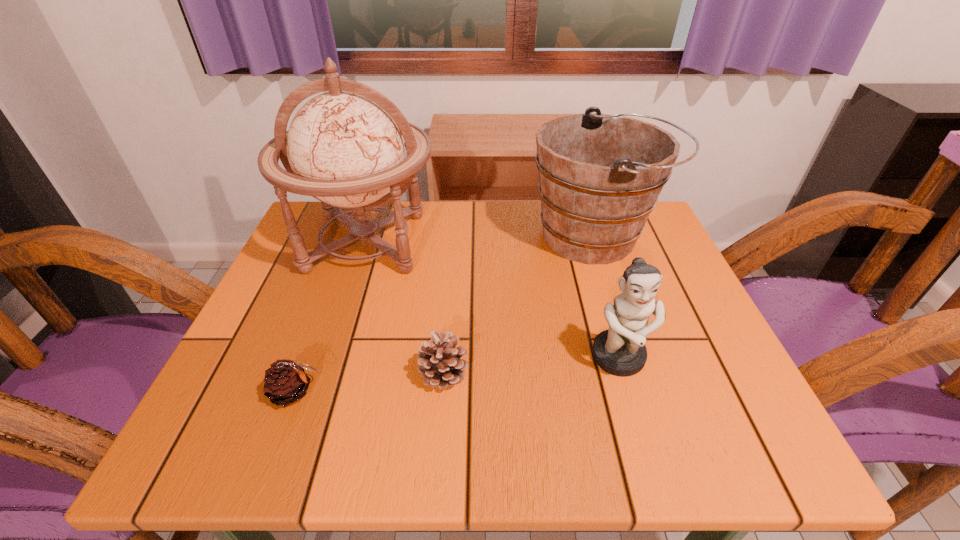
You are a GUI agent. You are given a task and a screenshot of the screen. Output one action in this format:
    pyautogui.click(x=<x>, y=<y>)
    Task: Click on the vacant area that satisfies the following two spatial constraints: 1. on the front side of the right pinecone; 2. with a leaf charm attached to the shorter pinecone
    
    Given the screenshot: What is the action you would take?
    pyautogui.click(x=443, y=392)

In order to click on vacant area in the image that satisfies the following two spatial constraints: 1. on the handle side of the bucket; 2. on the front-facing side of the third tallest object in this screenshot , I will do `click(636, 359)`.

Locate an element on the screen. free spot that satisfies the following two spatial constraints: 1. on the front-facing side of the tallest object; 2. with a leaf charm attached to the shorter pinecone is located at coordinates (317, 392).

At what (x,y) coordinates should I click in order to perform the action: click on free spot that satisfies the following two spatial constraints: 1. on the front-facing side of the tallest object; 2. with a leaf charm attached to the shorter pinecone. Please return your answer as a coordinate pair (x, y). The height and width of the screenshot is (540, 960). Looking at the image, I should click on (317, 392).